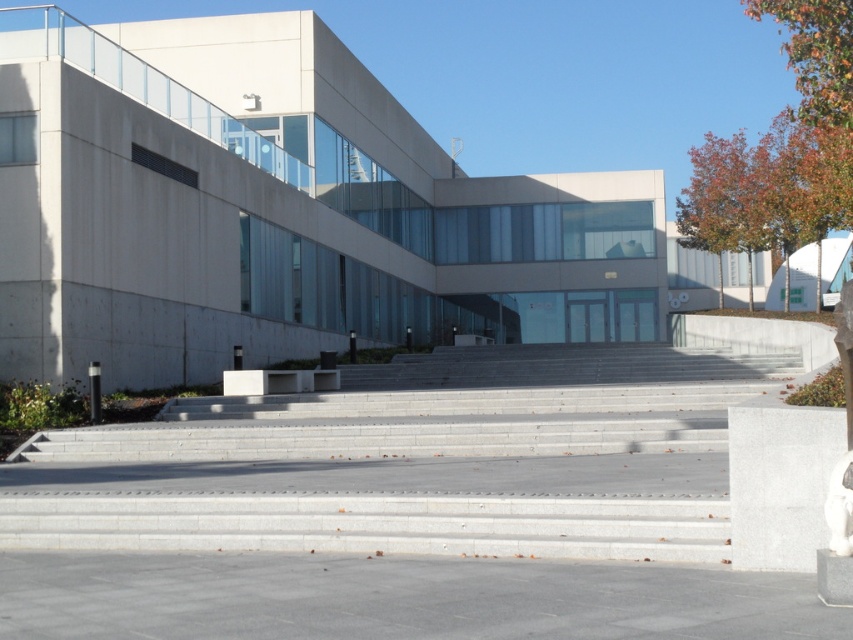
Who is lower down, gray concrete stairs at center or white granite block at center?

Positioned lower is gray concrete stairs at center.

Between gray concrete stairs at center and white granite block at center, which one appears on the left side from the viewer's perspective?

From the viewer's perspective, gray concrete stairs at center appears more on the left side.

At what (x,y) coordinates should I click in order to perform the action: click on gray concrete stairs at center. Please return your answer as a coordinate pair (x, y). Looking at the image, I should click on (456, 410).

Is gray concrete stairs at center to the right of autumn leaves at upper right from the viewer's perspective?

No, gray concrete stairs at center is not to the right of autumn leaves at upper right.

Between gray concrete stairs at center and autumn leaves at upper right, which one has less height?

gray concrete stairs at center is shorter.

Is point (94, 531) positioned in front of point (814, 234)?

Yes, point (94, 531) is closer to viewer.

Find the location of `gray concrete stairs at center`. gray concrete stairs at center is located at coordinates (456, 410).

Is autumn leaves at upper right positioned behind white granite block at center?

Yes, it is behind white granite block at center.

The width and height of the screenshot is (853, 640). What do you see at coordinates (767, 189) in the screenshot?
I see `autumn leaves at upper right` at bounding box center [767, 189].

The image size is (853, 640). I want to click on autumn leaves at upper right, so click(x=767, y=189).